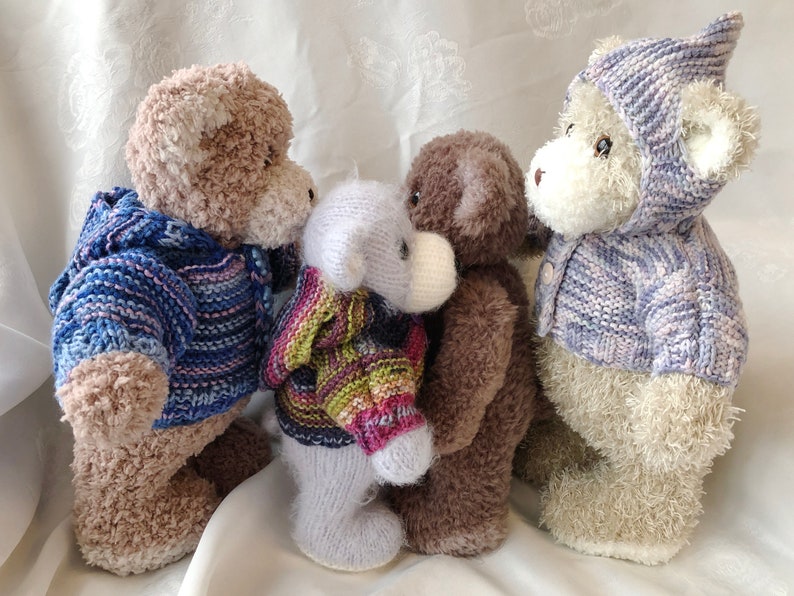
Locate an element on the screen. hood is located at coordinates (98, 229), (315, 336), (681, 52).